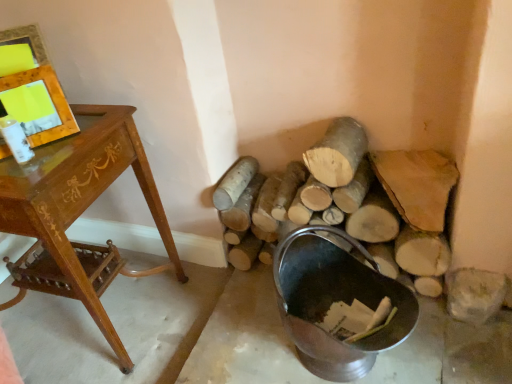
Question: From the image's perspective, is wooden frame at upper left beneath metallic bucket at lower right?

Choices:
 (A) no
 (B) yes

Answer: (A)

Question: Does wooden frame at upper left have a lesser width compared to metallic bucket at lower right?

Choices:
 (A) no
 (B) yes

Answer: (B)

Question: Could you tell me if wooden frame at upper left is facing metallic bucket at lower right?

Choices:
 (A) no
 (B) yes

Answer: (A)

Question: Is wooden frame at upper left positioned with its back to metallic bucket at lower right?

Choices:
 (A) yes
 (B) no

Answer: (B)

Question: From a real-world perspective, does wooden frame at upper left stand above metallic bucket at lower right?

Choices:
 (A) yes
 (B) no

Answer: (A)

Question: Is metallic bucket at lower right in front of or behind wooden frame at upper left in the image?

Choices:
 (A) behind
 (B) front

Answer: (B)

Question: Considering the positions of metallic bucket at lower right and wooden frame at upper left in the image, is metallic bucket at lower right taller or shorter than wooden frame at upper left?

Choices:
 (A) short
 (B) tall

Answer: (B)

Question: Is point click(x=311, y=319) positioned closer to the camera than point click(x=31, y=142)?

Choices:
 (A) closer
 (B) farther

Answer: (B)

Question: Looking at their shapes, would you say metallic bucket at lower right is wider or thinner than wooden frame at upper left?

Choices:
 (A) thin
 (B) wide

Answer: (B)

Question: In terms of width, does metallic bucket at lower right look wider or thinner when compared to natural wood log at center, arranged as the 1th log when viewed from the right?

Choices:
 (A) wide
 (B) thin

Answer: (A)

Question: From their relative heights in the image, would you say metallic bucket at lower right is taller or shorter than natural wood log at center, marked as the 2th log in a left-to-right arrangement?

Choices:
 (A) short
 (B) tall

Answer: (B)

Question: In the image, is metallic bucket at lower right positioned in front of or behind natural wood log at center, marked as the 2th log in a left-to-right arrangement?

Choices:
 (A) front
 (B) behind

Answer: (A)

Question: Choose the correct answer: Is metallic bucket at lower right inside natural wood log at center, marked as the 2th log in a left-to-right arrangement, or outside it?

Choices:
 (A) inside
 (B) outside

Answer: (B)

Question: Do you think wooden desk at left is within natural wood log at center, positioned as the 2th log in right-to-left order, or outside of it?

Choices:
 (A) outside
 (B) inside

Answer: (A)

Question: Considering their positions, is wooden desk at left located in front of or behind natural wood log at center, marked as the 1th log in a left-to-right arrangement?

Choices:
 (A) behind
 (B) front

Answer: (B)